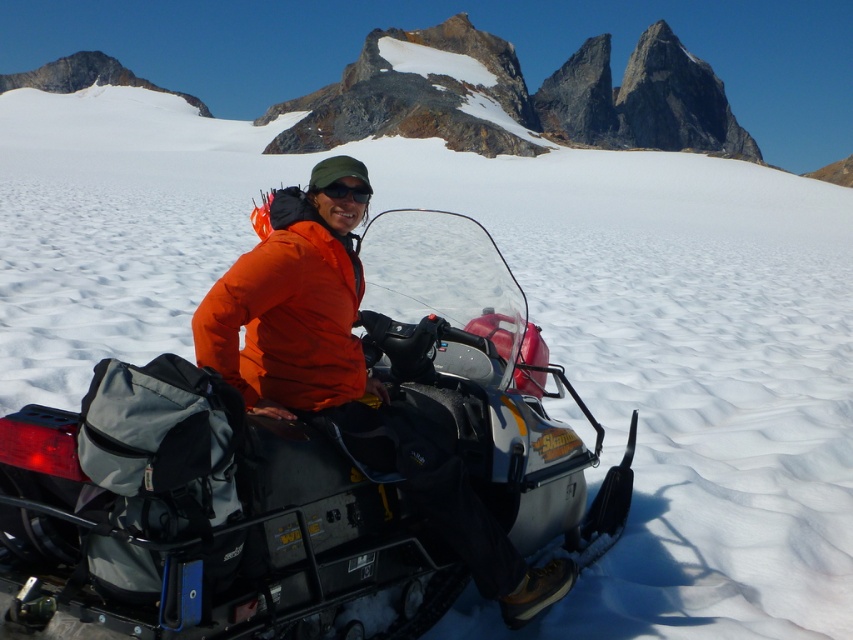
Which of these two, matte black snowmobile at center or black matte sunglasses at center, stands taller?

matte black snowmobile at center

Is point (206, 506) in front of point (328, 186)?

Yes, point (206, 506) is in front of point (328, 186).

Where is `matte black snowmobile at center`? The image size is (853, 640). matte black snowmobile at center is located at coordinates (212, 538).